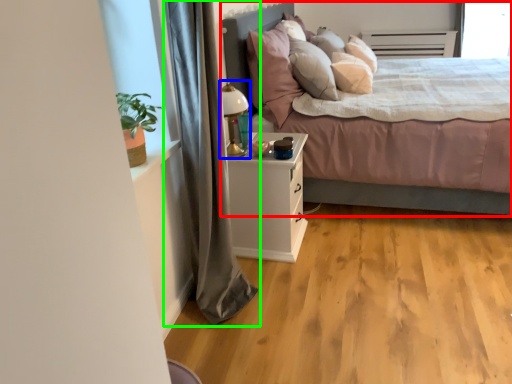
Question: Which object is positioned farthest from bed (highlighted by a red box)? Select from table lamp (highlighted by a blue box) and curtain (highlighted by a green box).

Choices:
 (A) table lamp
 (B) curtain

Answer: (B)